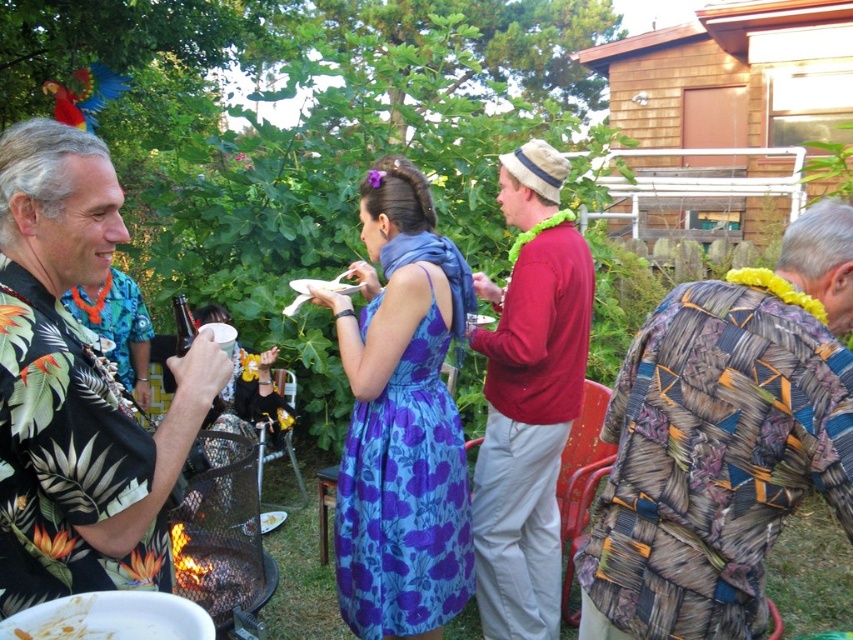
You are organizing a clothing donation drive and need to categorize shirts by size. You have two shirts in front of you, the floral print shirt at left and the red cotton shirt at center. Which shirt should you place in the small size bin?

The floral print shirt at left should be placed in the small size bin because it has a smaller size compared to the red cotton shirt at center.

You are organizing a game of musical chairs for the party and need to arrange chairs in a row between the patchwork fabric shirt at right and the floral print shirt at left. If the chairs are 40 cm wide each, how many chairs can fit between them?

The patchwork fabric shirt at right might be wider than the floral print shirt at left, but without knowing the exact distance between them, it is impossible to determine how many chairs can fit between them.